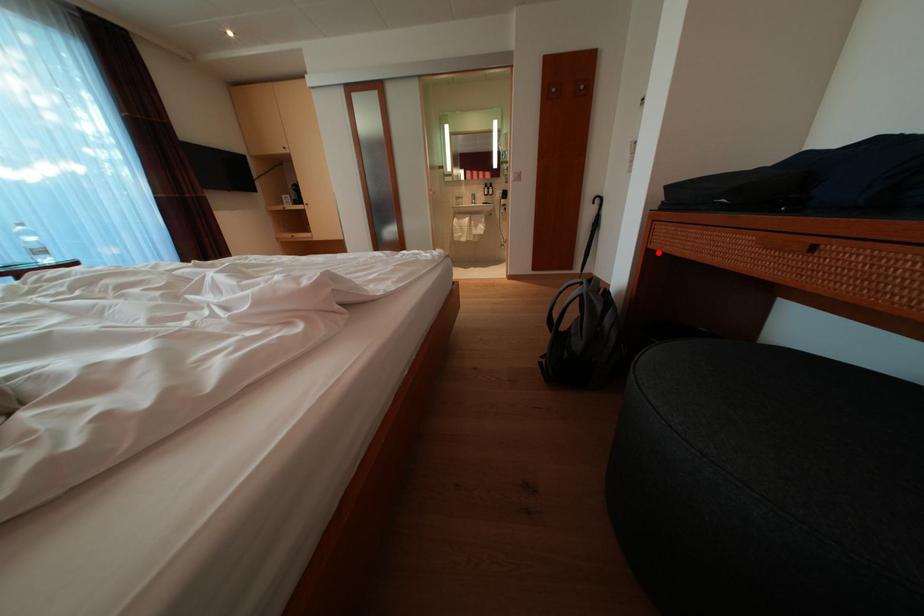
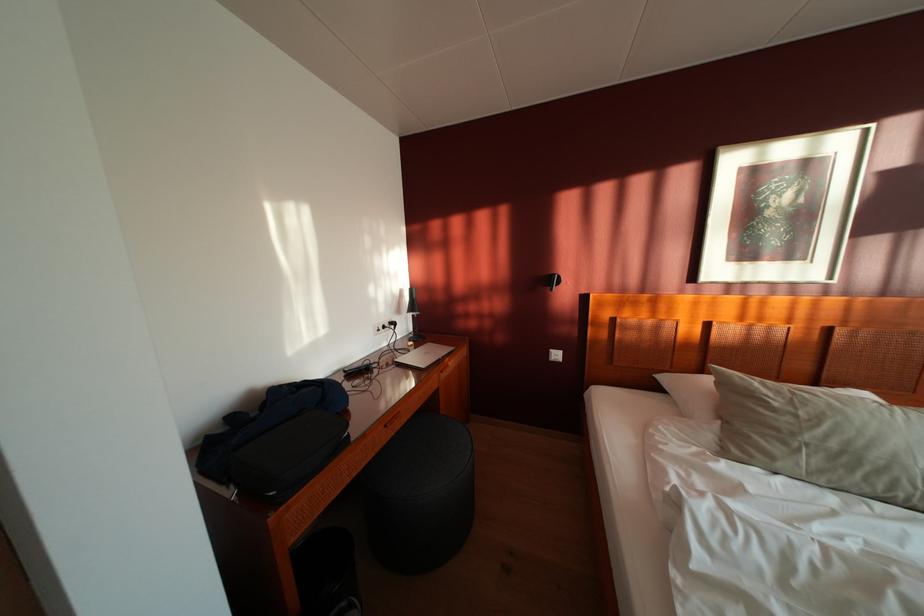
Locate, in the second image, the point that corresponds to the highlighted location in the first image.

(301, 546)